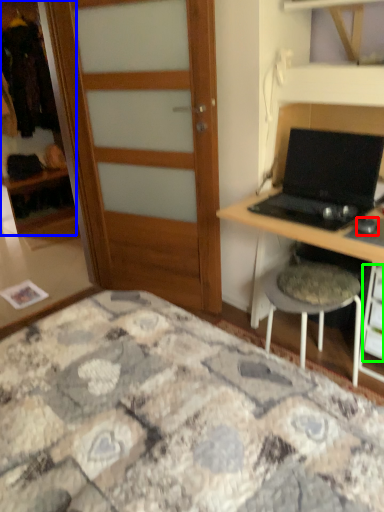
Question: Which object is the farthest from mouse (highlighted by a red box)? Choose among these: cabinetry (highlighted by a blue box) or drawer (highlighted by a green box).

Choices:
 (A) cabinetry
 (B) drawer

Answer: (A)